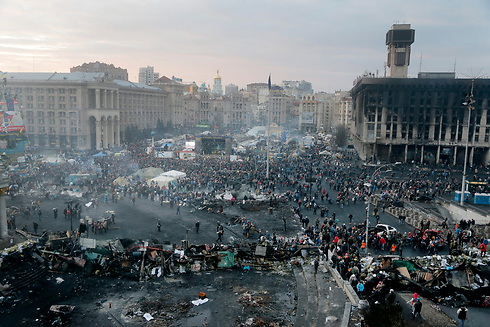
Locate an element on the screen. The height and width of the screenshot is (327, 490). trash is located at coordinates (68, 254), (144, 261), (247, 254).